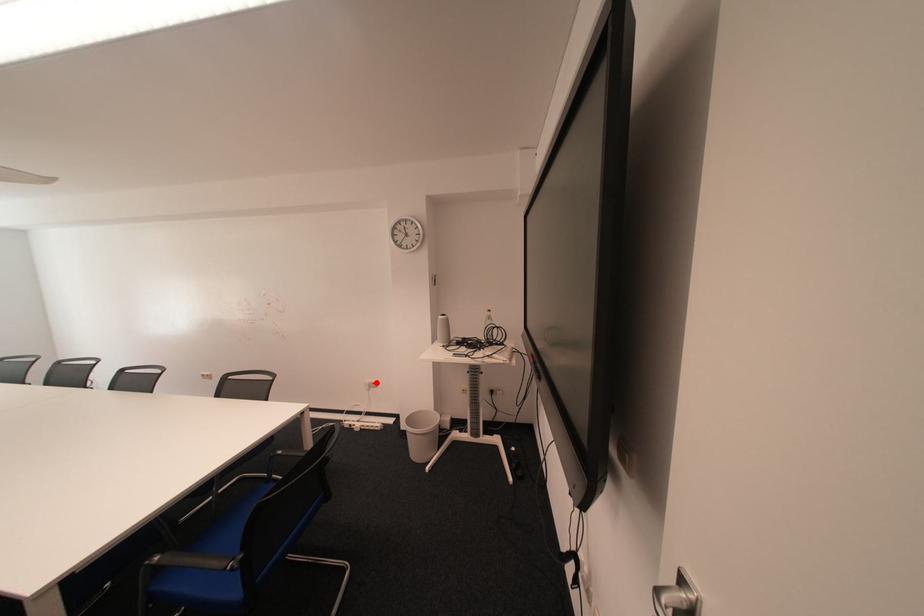
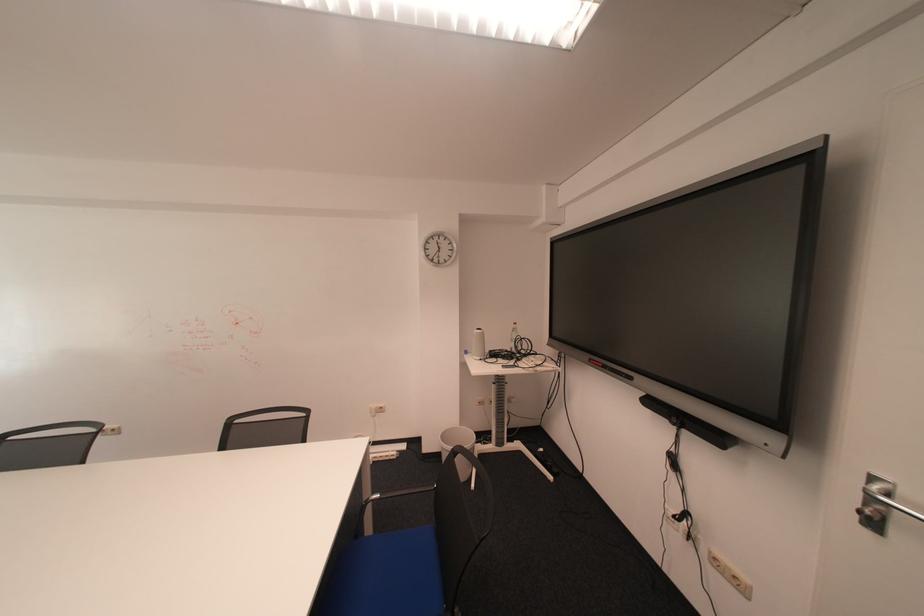
Where in the second image is the point corresponding to the highlighted location from the first image?

(382, 408)